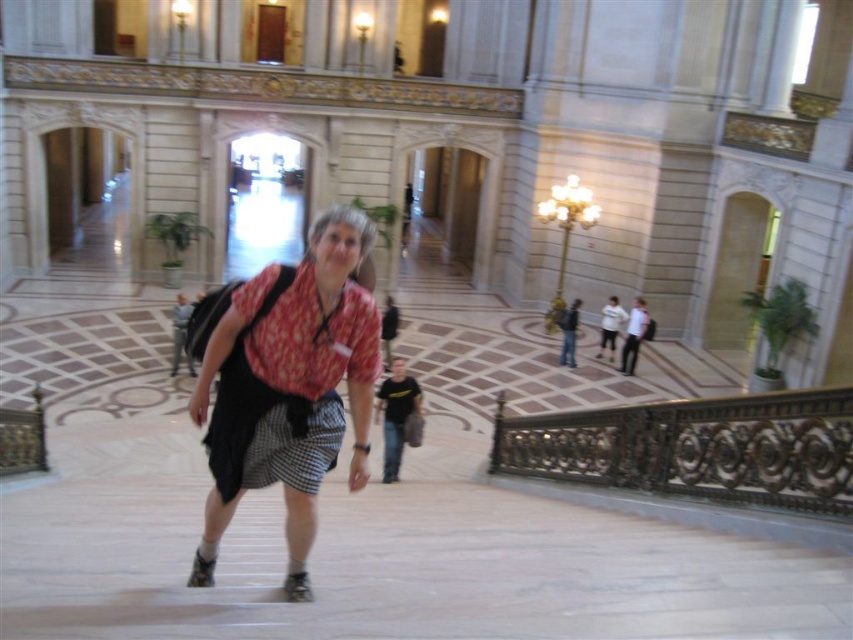
Consider the image. You are an interior designer assessing the space between the matte pink blouse at center and the gold ornate railing at lower right. Which object is wider?

The matte pink blouse at center is wider than the gold ornate railing at lower right.

You are a tour guide leading a group through the grand hall. You notice the matte pink blouse at center and the gold ornate railing at lower right. Which object is closer to the group?

The matte pink blouse at center is closer to the group since it is only 7.30 meters away from the gold ornate railing at lower right, implying the railing is farther away.

You are an interior designer assessing the space for safety. The matte pink blouse at center is worn by a guest standing near the gold ornate railing at lower right. Could there be a risk of the guest accidentally stepping onto the railing? Please explain based on their positions.

The matte pink blouse at center is positioned over the gold ornate railing at lower right, meaning the guest is standing directly above the railing. This placement increases the risk of the guest accidentally stepping onto or over the railing, posing a safety hazard.